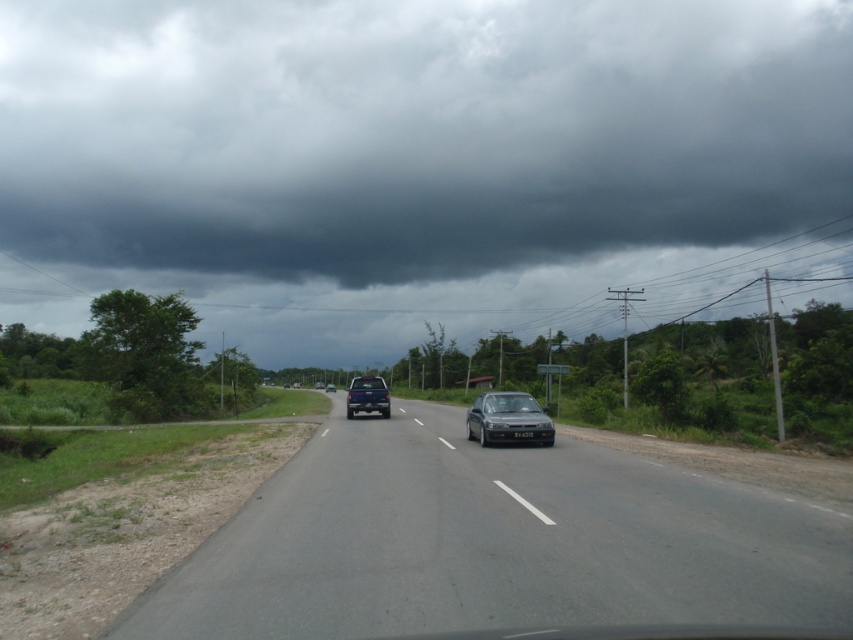
Is satin silver sedan at center wider than blue metallic truck at center?

No.

Who is more distant from viewer, (495, 422) or (328, 385)?

Point (328, 385)

Where is `satin silver sedan at center`? The height and width of the screenshot is (640, 853). satin silver sedan at center is located at coordinates (508, 419).

Can you confirm if metallic blue truck at center is wider than blue metallic truck at center?

No.

Is metallic blue truck at center below blue metallic truck at center?

No.

Between point (374, 385) and point (328, 385), which one is positioned behind?

Point (328, 385)

This screenshot has width=853, height=640. In order to click on metallic blue truck at center in this screenshot , I will do `click(367, 396)`.

Can you confirm if satin silver sedan at center is wider than metallic blue truck at center?

In fact, satin silver sedan at center might be narrower than metallic blue truck at center.

Does satin silver sedan at center appear over metallic blue truck at center?

Correct, satin silver sedan at center is located above metallic blue truck at center.

Between point (537, 412) and point (376, 408), which one is positioned behind?

Point (376, 408)

Identify the location of satin silver sedan at center. This screenshot has height=640, width=853. (508, 419).